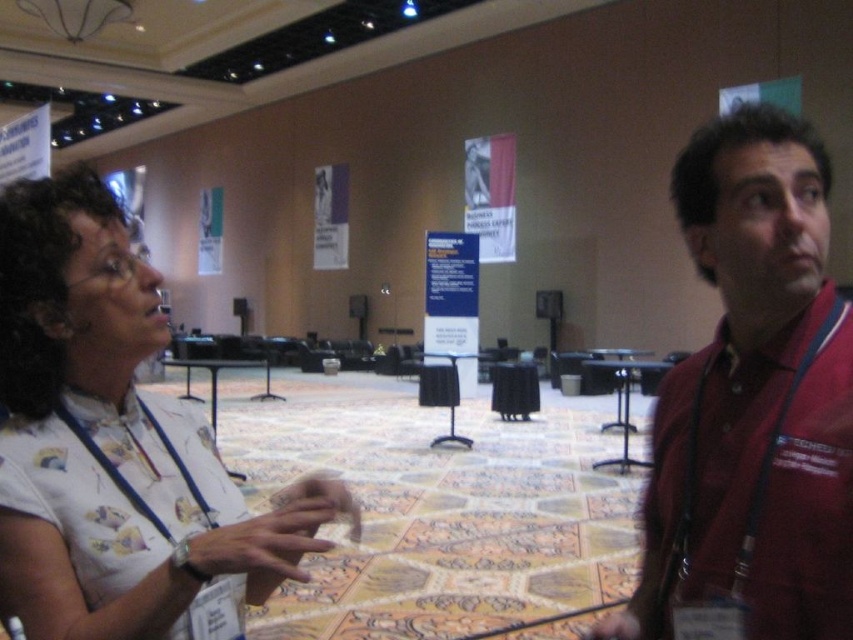
In the scene shown: Between white printed shirt at left and maroon fabric shirt at right, which one appears on the right side from the viewer's perspective?

Positioned to the right is maroon fabric shirt at right.

Does white printed shirt at left appear on the right side of maroon fabric shirt at right?

In fact, white printed shirt at left is to the left of maroon fabric shirt at right.

This screenshot has width=853, height=640. In order to click on white printed shirt at left in this screenshot , I will do `click(117, 445)`.